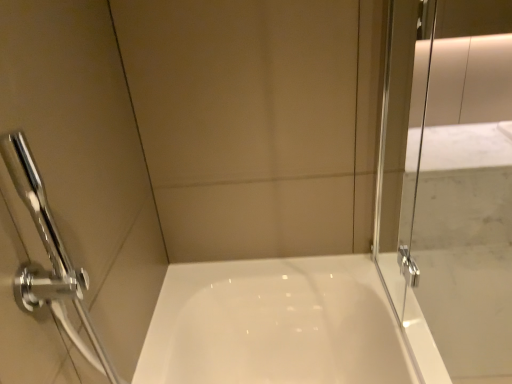
Question: Is transparent glass screen door at right spatially inside chrome metallic showerhead at left, or outside of it?

Choices:
 (A) inside
 (B) outside

Answer: (B)

Question: Considering the positions of transparent glass screen door at right and chrome metallic showerhead at left in the image, is transparent glass screen door at right bigger or smaller than chrome metallic showerhead at left?

Choices:
 (A) big
 (B) small

Answer: (A)

Question: From a real-world perspective, is transparent glass screen door at right physically located above or below chrome metallic showerhead at left?

Choices:
 (A) above
 (B) below

Answer: (A)

Question: From their relative heights in the image, would you say chrome metallic showerhead at left is taller or shorter than transparent glass screen door at right?

Choices:
 (A) tall
 (B) short

Answer: (B)

Question: Considering the positions of point (19, 195) and point (470, 62), is point (19, 195) closer or farther from the camera than point (470, 62)?

Choices:
 (A) closer
 (B) farther

Answer: (A)

Question: Considering the positions of chrome metallic showerhead at left and transparent glass screen door at right in the image, is chrome metallic showerhead at left bigger or smaller than transparent glass screen door at right?

Choices:
 (A) small
 (B) big

Answer: (A)

Question: Considering the positions of chrome metallic showerhead at left and transparent glass screen door at right in the image, is chrome metallic showerhead at left wider or thinner than transparent glass screen door at right?

Choices:
 (A) wide
 (B) thin

Answer: (A)